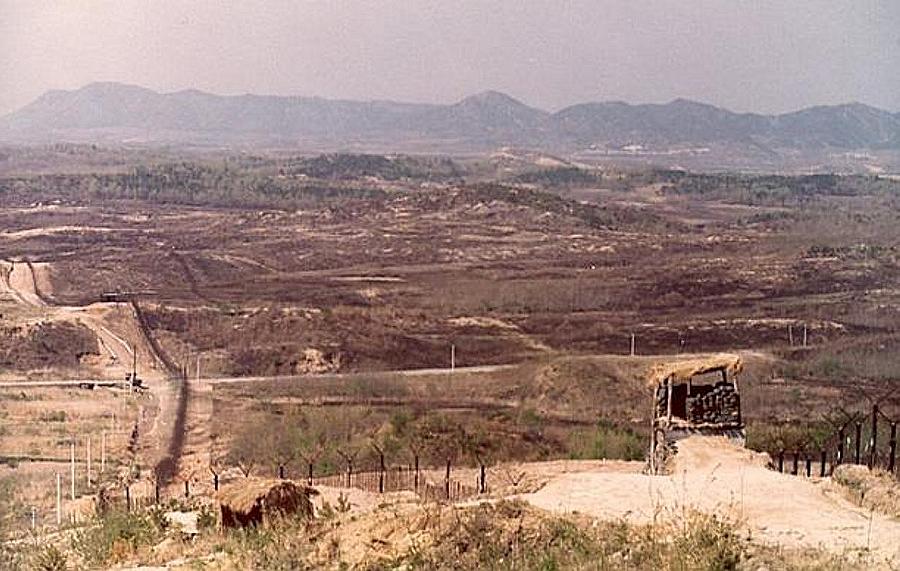
Locate an element on the screen. support beams is located at coordinates (670, 399), (684, 386), (733, 382), (653, 397), (268, 514).